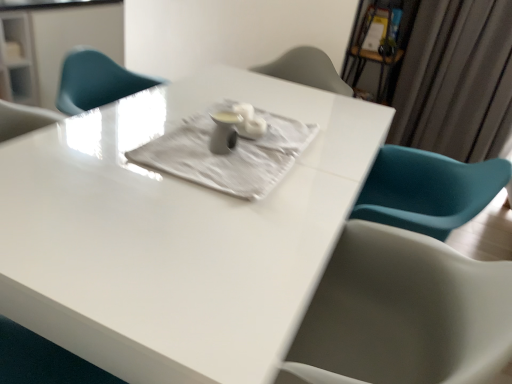
Describe the element at coordinates (228, 154) in the screenshot. I see `white textured cloth at center` at that location.

Where is `white glossy table at center`? white glossy table at center is located at coordinates pos(175,234).

From the image's perspective, is silky gray curtain at upper right located above white glossy table at center?

Yes, from the image's perspective, silky gray curtain at upper right is over white glossy table at center.

Measure the distance from silky gray curtain at upper right to white glossy table at center.

5.90 feet.

Between silky gray curtain at upper right and white glossy table at center, which one appears on the right side from the viewer's perspective?

silky gray curtain at upper right.

Is silky gray curtain at upper right positioned with its back to white glossy table at center?

No.

Locate an element on the screen. The image size is (512, 384). table below the white textured cloth at center (from a real-world perspective) is located at coordinates (175, 234).

Does point (166, 171) come behind point (202, 322)?

Yes, it is behind point (202, 322).

Does white glossy table at center touch silky gray curtain at upper right?

Result: white glossy table at center and silky gray curtain at upper right are clearly separated.

The image size is (512, 384). I want to click on curtain behind the white glossy table at center, so click(456, 80).

Can you confirm if white glossy table at center is wider than silky gray curtain at upper right?

Indeed, white glossy table at center has a greater width compared to silky gray curtain at upper right.

Is white glossy table at center taller or shorter than silky gray curtain at upper right?

Clearly, white glossy table at center is shorter compared to silky gray curtain at upper right.

Which object is further away from the camera taking this photo, white textured cloth at center or silky gray curtain at upper right?

silky gray curtain at upper right is more distant.

From the image's perspective, is white textured cloth at center located above or below silky gray curtain at upper right?

From the image's perspective, white textured cloth at center appears below silky gray curtain at upper right.

From the picture: Who is taller, white textured cloth at center or silky gray curtain at upper right?

silky gray curtain at upper right.

How many degrees apart are the facing directions of white textured cloth at center and silky gray curtain at upper right?

90.1 degrees.

Is white glossy table at center positioned with its back to white textured cloth at center?

No, white textured cloth at center is not at the back of white glossy table at center.

From a real-world perspective, is white glossy table at center positioned under white textured cloth at center based on gravity?

Yes, from a real-world perspective, white glossy table at center is below white textured cloth at center.

Is white glossy table at center bigger than white textured cloth at center?

Yes, white glossy table at center is bigger than white textured cloth at center.

Considering the positions of objects white glossy table at center and white textured cloth at center in the image provided, who is more to the right, white glossy table at center or white textured cloth at center?

Positioned to the right is white textured cloth at center.

Which is less distant, (449, 74) or (194, 115)?

Point (194, 115)

The height and width of the screenshot is (384, 512). I want to click on curtain on the right side of white textured cloth at center, so click(456, 80).

Between silky gray curtain at upper right and white textured cloth at center, which one appears on the left side from the viewer's perspective?

Positioned to the left is white textured cloth at center.

Is silky gray curtain at upper right wider than white textured cloth at center?

No.

Identify the location of curtain on the right of white glossy table at center. (456, 80).

The height and width of the screenshot is (384, 512). Find the location of `cloth above the white glossy table at center (from the image's perspective)`. cloth above the white glossy table at center (from the image's perspective) is located at coordinates (228, 154).

When comparing their distances from white textured cloth at center, does silky gray curtain at upper right or white glossy table at center seem closer?

white glossy table at center is closer to white textured cloth at center.

When comparing their distances from white glossy table at center, does white textured cloth at center or silky gray curtain at upper right seem further?

silky gray curtain at upper right is positioned further to the anchor white glossy table at center.

Considering their positions, is white glossy table at center positioned closer to silky gray curtain at upper right than white textured cloth at center?

white glossy table at center.

Based on their spatial positions, is white glossy table at center or silky gray curtain at upper right closer to white textured cloth at center?

Among the two, white glossy table at center is located nearer to white textured cloth at center.

Looking at the image, which one is located closer to white glossy table at center, silky gray curtain at upper right or white textured cloth at center?

white textured cloth at center is positioned closer to the anchor white glossy table at center.

When comparing their distances from silky gray curtain at upper right, does white textured cloth at center or white glossy table at center seem closer?

white glossy table at center is closer to silky gray curtain at upper right.

Where is `cloth located between white glossy table at center and silky gray curtain at upper right in the depth direction`? This screenshot has height=384, width=512. cloth located between white glossy table at center and silky gray curtain at upper right in the depth direction is located at coordinates (228, 154).